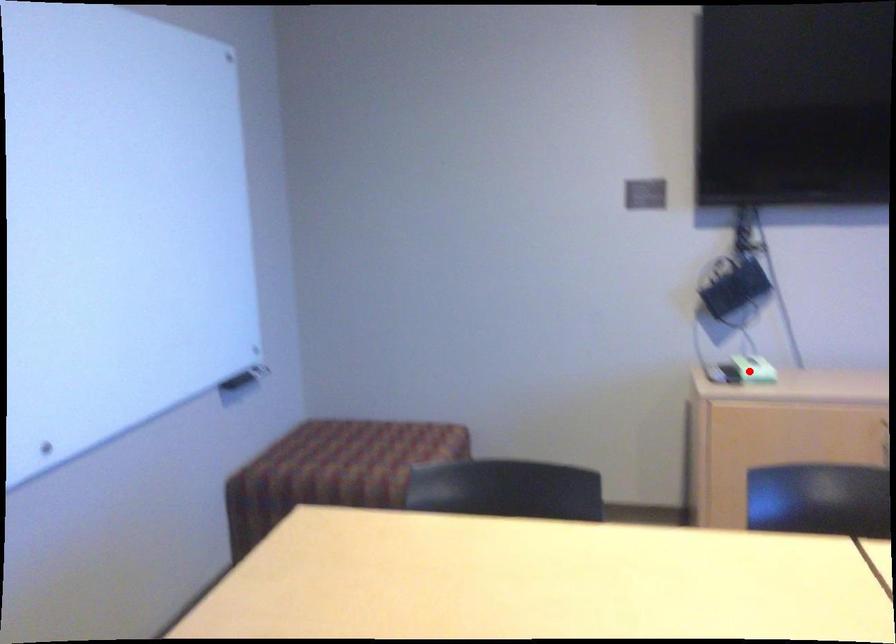
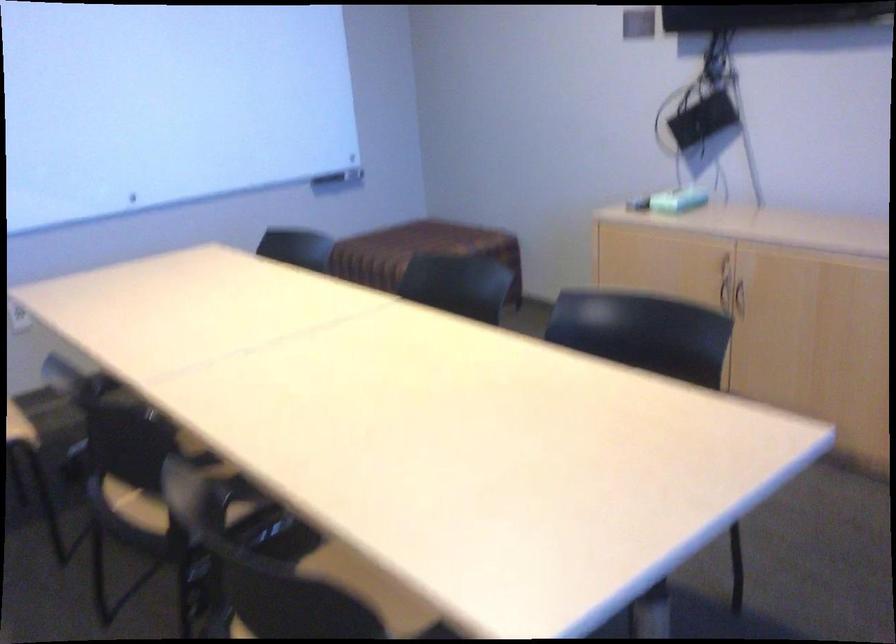
Find the pixel in the second image that matches the highlighted location in the first image.

(677, 200)